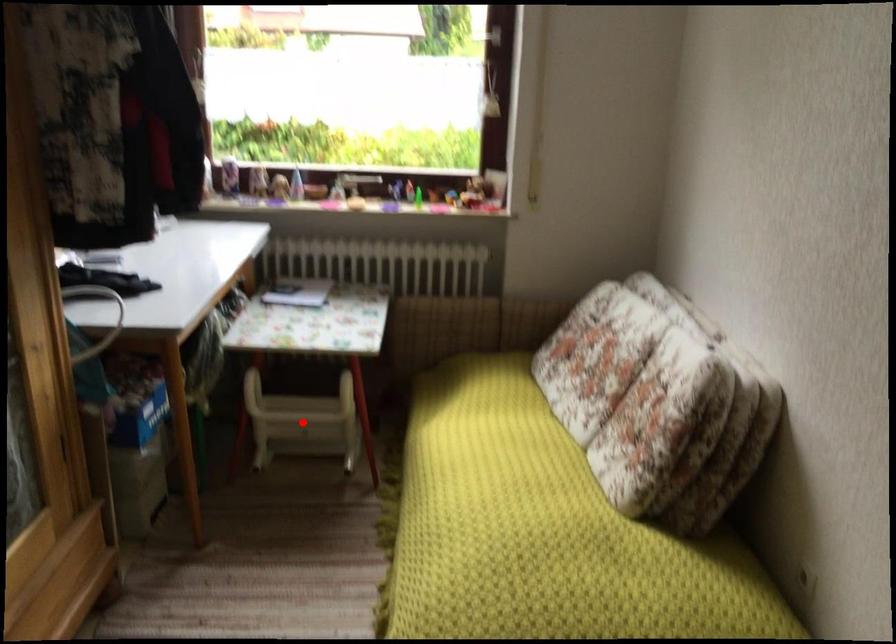
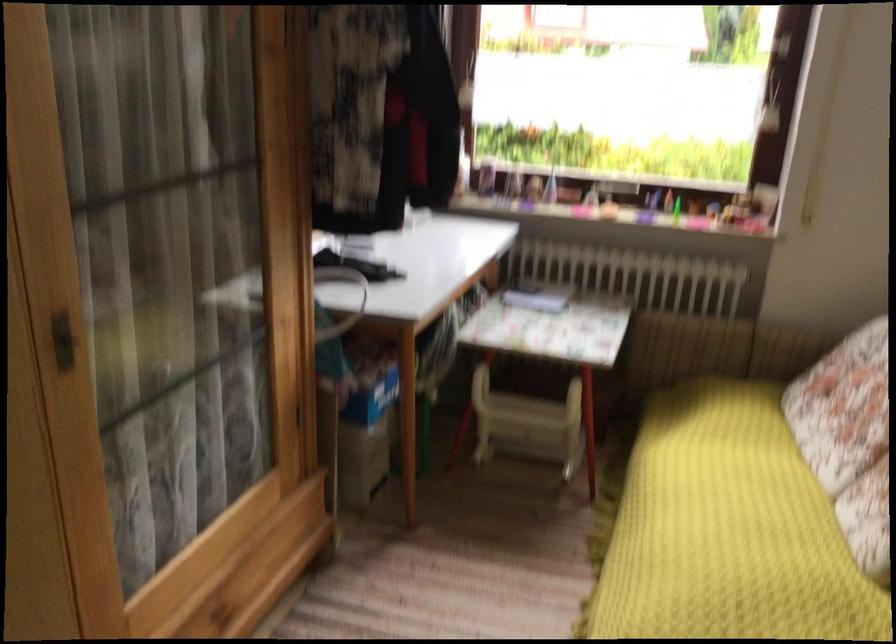
Question: I am providing you with two images of the same scene from different viewpoints. A red point is marked on the first image. Is the red point's position out of view in image 2?

Choices:
 (A) Yes
 (B) No

Answer: (B)